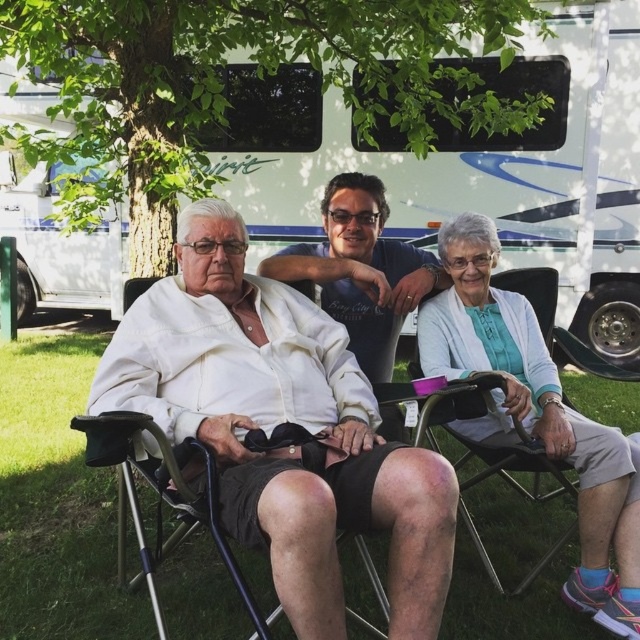
Is white textured cardigan at lower right wider than metallic folding chair at center?

Yes.

Is white textured cardigan at lower right above metallic folding chair at center?

Yes.

What do you see at coordinates (536, 413) in the screenshot? I see `white textured cardigan at lower right` at bounding box center [536, 413].

Identify the location of white textured cardigan at lower right. The image size is (640, 640). (x=536, y=413).

Is white matte shirt at center smaller than metallic folding chair at center?

Actually, white matte shirt at center might be larger than metallic folding chair at center.

Describe the element at coordinates (360, 269) in the screenshot. I see `white matte shirt at center` at that location.

Between point (396, 317) and point (152, 605), which one is positioned in front?

Point (152, 605) is more forward.

Where is `white matte shirt at center`? This screenshot has width=640, height=640. white matte shirt at center is located at coordinates (360, 269).

Can you confirm if white cotton shirt at center is wider than metallic folding chair at center?

Correct, the width of white cotton shirt at center exceeds that of metallic folding chair at center.

What do you see at coordinates (278, 422) in the screenshot?
I see `white cotton shirt at center` at bounding box center [278, 422].

The height and width of the screenshot is (640, 640). Describe the element at coordinates (278, 422) in the screenshot. I see `white cotton shirt at center` at that location.

This screenshot has height=640, width=640. In order to click on white cotton shirt at center in this screenshot , I will do `click(278, 422)`.